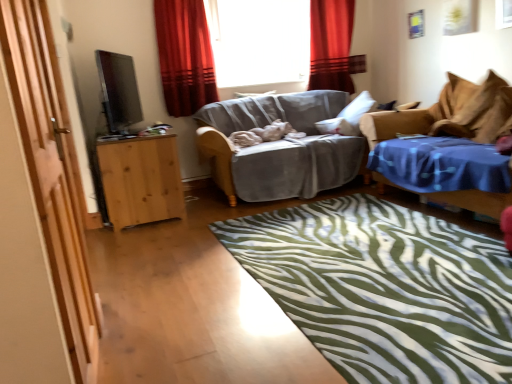
Question: Should I look upward or downward to see green zebra-patterned rug at center?

Choices:
 (A) down
 (B) up

Answer: (A)

Question: Is light brown wooden cabinet at left thinner than satin black tv at left?

Choices:
 (A) yes
 (B) no

Answer: (B)

Question: Could you tell me if light brown wooden cabinet at left is facing satin black tv at left?

Choices:
 (A) no
 (B) yes

Answer: (A)

Question: From the image's perspective, does light brown wooden cabinet at left appear higher than satin black tv at left?

Choices:
 (A) yes
 (B) no

Answer: (B)

Question: Considering the relative positions of light brown wooden cabinet at left and satin black tv at left in the image provided, is light brown wooden cabinet at left to the right of satin black tv at left from the viewer's perspective?

Choices:
 (A) no
 (B) yes

Answer: (B)

Question: Is light brown wooden cabinet at left further to camera compared to satin black tv at left?

Choices:
 (A) yes
 (B) no

Answer: (A)

Question: Is light brown wooden cabinet at left shorter than satin black tv at left?

Choices:
 (A) yes
 (B) no

Answer: (B)

Question: Considering the relative sizes of wooden door at left and transparent glass window at center in the image provided, is wooden door at left smaller than transparent glass window at center?

Choices:
 (A) no
 (B) yes

Answer: (B)

Question: From a real-world perspective, is wooden door at left over transparent glass window at center?

Choices:
 (A) no
 (B) yes

Answer: (A)

Question: Considering the relative sizes of wooden door at left and transparent glass window at center in the image provided, is wooden door at left shorter than transparent glass window at center?

Choices:
 (A) yes
 (B) no

Answer: (B)

Question: From the image's perspective, is wooden door at left beneath transparent glass window at center?

Choices:
 (A) yes
 (B) no

Answer: (A)

Question: Is wooden door at left taller than transparent glass window at center?

Choices:
 (A) yes
 (B) no

Answer: (A)

Question: Are wooden door at left and transparent glass window at center located far from each other?

Choices:
 (A) yes
 (B) no

Answer: (A)

Question: From the image's perspective, is red velvet curtain at upper center, acting as the second curtain starting from the left, on top of light brown wooden cabinet at left?

Choices:
 (A) no
 (B) yes

Answer: (B)